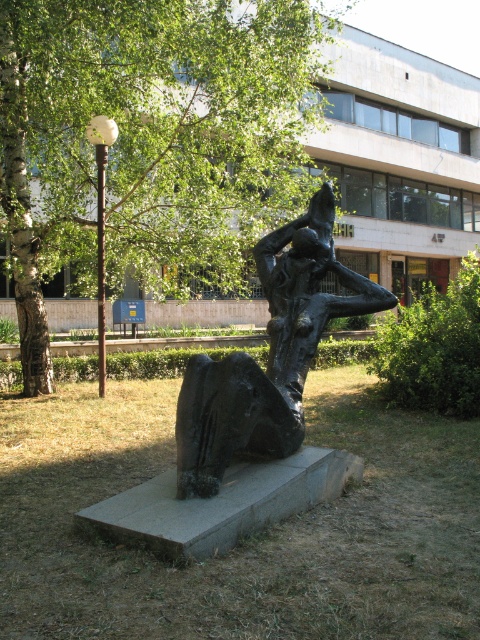
Question: Is green leafy tree at upper left behind bronze sculpture at center?

Choices:
 (A) yes
 (B) no

Answer: (A)

Question: Can you confirm if green leafy tree at upper left is positioned below bronze sculpture at center?

Choices:
 (A) yes
 (B) no

Answer: (B)

Question: Among these objects, which one is farthest from the camera?

Choices:
 (A) bronze sculpture at center
 (B) green leafy tree at upper left

Answer: (B)

Question: Is green leafy tree at upper left to the right of bronze sculpture at center from the viewer's perspective?

Choices:
 (A) no
 (B) yes

Answer: (A)

Question: Which object is closer to the camera taking this photo?

Choices:
 (A) bronze sculpture at center
 (B) green leafy tree at upper left

Answer: (A)